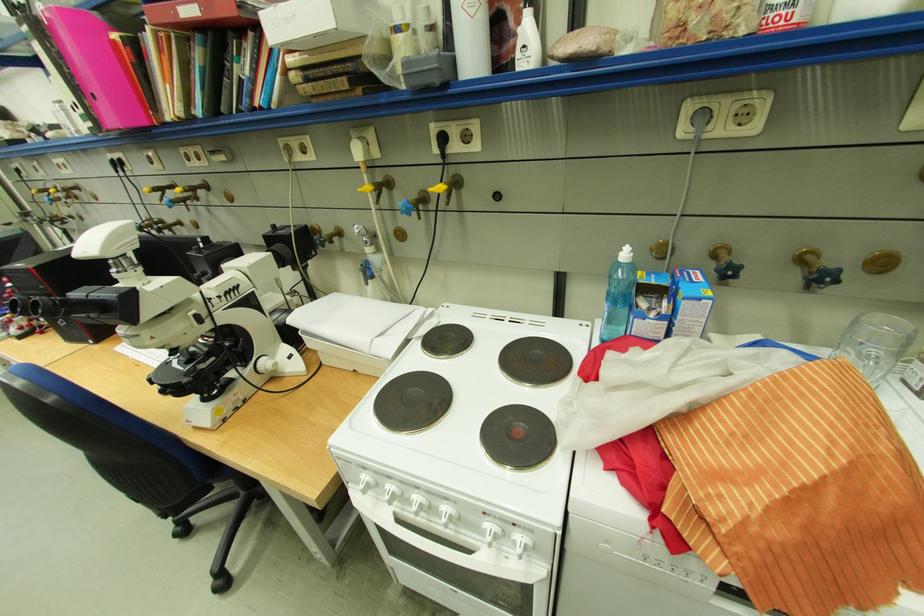
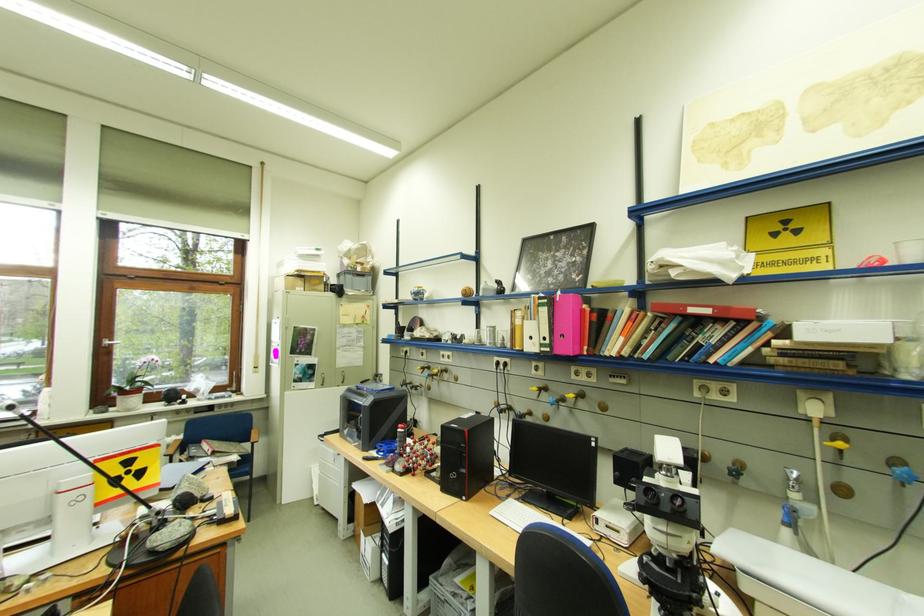
The point at (415, 209) is marked in the first image. Where is the corresponding point in the second image?

(916, 477)